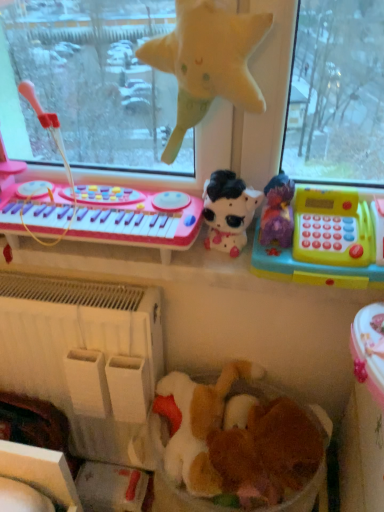
This screenshot has width=384, height=512. Describe the element at coordinates (107, 215) in the screenshot. I see `pink plastic musical keyboard at left` at that location.

What do you see at coordinates (228, 211) in the screenshot? The height and width of the screenshot is (512, 384). I see `plush black and white cow at center, arranged as the 2th toy when viewed from the top` at bounding box center [228, 211].

This screenshot has height=512, width=384. What do you see at coordinates (83, 354) in the screenshot?
I see `white plastic radiator at lower left` at bounding box center [83, 354].

Measure the distance between yellow plush star at upper center, which appears as the 5th toy when ordered from the bottom, and camera.

yellow plush star at upper center, which appears as the 5th toy when ordered from the bottom, is 26.33 inches away from camera.

In order to face yellow plastic cash register at right, the third toy in the top-to-bottom sequence, should I rotate leftwards or rightwards?

Turn right by 17.354 degrees to look at yellow plastic cash register at right, the third toy in the top-to-bottom sequence.

Identify the location of fuzzy brown teddy bear at center, positioned as the 1th toy in bottom-to-top order. This screenshot has width=384, height=512. (269, 452).

Based on the photo, who is bigger, plush black and white cow at center, positioned as the fourth toy in bottom-to-top order, or fuzzy brown teddy bear at center, which appears as the fifth toy when viewed from the top?

fuzzy brown teddy bear at center, which appears as the fifth toy when viewed from the top.

In terms of height, does plush black and white cow at center, arranged as the 2th toy when viewed from the top, look taller or shorter compared to fuzzy brown teddy bear at center, which appears as the fifth toy when viewed from the top?

Considering their sizes, plush black and white cow at center, arranged as the 2th toy when viewed from the top, has more height than fuzzy brown teddy bear at center, which appears as the fifth toy when viewed from the top.

Is plush black and white cow at center, positioned as the fourth toy in bottom-to-top order, turned away from fuzzy brown teddy bear at center, which appears as the fifth toy when viewed from the top?

plush black and white cow at center, positioned as the fourth toy in bottom-to-top order, is not turned away from fuzzy brown teddy bear at center, which appears as the fifth toy when viewed from the top.

Between plush black and white cow at center, positioned as the fourth toy in bottom-to-top order, and fuzzy brown teddy bear at center, which appears as the fifth toy when viewed from the top, which one appears on the right side from the viewer's perspective?

From the viewer's perspective, fuzzy brown teddy bear at center, which appears as the fifth toy when viewed from the top, appears more on the right side.

How much distance is there between white plastic radiator at lower left and fuzzy brown teddy bear at center, which appears as the fifth toy when viewed from the top?

A distance of 37.92 centimeters exists between white plastic radiator at lower left and fuzzy brown teddy bear at center, which appears as the fifth toy when viewed from the top.

Are white plastic radiator at lower left and fuzzy brown teddy bear at center, which appears as the fifth toy when viewed from the top, far apart?

No, white plastic radiator at lower left is in close proximity to fuzzy brown teddy bear at center, which appears as the fifth toy when viewed from the top.

Starting from the white plastic radiator at lower left, which toy is the 3rd one in front? Please provide its 2D coordinates.

[(269, 452)]

How many degrees apart are the facing directions of white plastic radiator at lower left and fuzzy brown teddy bear at center, positioned as the 1th toy in bottom-to-top order?

The facing directions of white plastic radiator at lower left and fuzzy brown teddy bear at center, positioned as the 1th toy in bottom-to-top order, are 179 degrees apart.

Which object is wider, plush black and white cow at center, arranged as the 2th toy when viewed from the top, or white plastic radiator at lower left?

With larger width is white plastic radiator at lower left.

Is plush black and white cow at center, arranged as the 2th toy when viewed from the top, to the right of white plastic radiator at lower left from the viewer's perspective?

Yes.

Is plush black and white cow at center, positioned as the fourth toy in bottom-to-top order, positioned far away from white plastic radiator at lower left?

No, plush black and white cow at center, positioned as the fourth toy in bottom-to-top order, is not far away from white plastic radiator at lower left.

Is yellow plastic cash register at right, the third toy in the top-to-bottom sequence, completely or partially inside pink plastic musical keyboard at left?

No, yellow plastic cash register at right, the third toy in the top-to-bottom sequence, is not a part of pink plastic musical keyboard at left.

Is pink plastic musical keyboard at left looking in the opposite direction of yellow plastic cash register at right, the third toy in the top-to-bottom sequence?

No, yellow plastic cash register at right, the third toy in the top-to-bottom sequence, is not at the back of pink plastic musical keyboard at left.

Which point is more distant from viewer, (108, 240) or (373, 247)?

The point (108, 240) is behind.

Which of these two, pink plastic musical keyboard at left or yellow plastic cash register at right, which is counted as the 3th toy, starting from the bottom, is wider?

pink plastic musical keyboard at left is wider.

Measure the distance between yellow plastic cash register at right, the third toy in the top-to-bottom sequence, and plush black and white cow at center, arranged as the 2th toy when viewed from the top.

yellow plastic cash register at right, the third toy in the top-to-bottom sequence, is 5.51 inches from plush black and white cow at center, arranged as the 2th toy when viewed from the top.

Can you tell me how much yellow plastic cash register at right, which is counted as the 3th toy, starting from the bottom, and plush black and white cow at center, arranged as the 2th toy when viewed from the top, differ in facing direction?

0.00216 degrees.

From the image's perspective, would you say yellow plastic cash register at right, which is counted as the 3th toy, starting from the bottom, is shown under plush black and white cow at center, arranged as the 2th toy when viewed from the top?

Yes, from the image's perspective, yellow plastic cash register at right, which is counted as the 3th toy, starting from the bottom, is beneath plush black and white cow at center, arranged as the 2th toy when viewed from the top.

Considering the relative sizes of yellow plastic cash register at right, which is counted as the 3th toy, starting from the bottom, and plush black and white cow at center, positioned as the fourth toy in bottom-to-top order, in the image provided, is yellow plastic cash register at right, which is counted as the 3th toy, starting from the bottom, shorter than plush black and white cow at center, positioned as the fourth toy in bottom-to-top order,?

Incorrect, the height of yellow plastic cash register at right, which is counted as the 3th toy, starting from the bottom, does not fall short of that of plush black and white cow at center, positioned as the fourth toy in bottom-to-top order.

Who is shorter, fuzzy brown teddy bear at center, which appears as the fifth toy when viewed from the top, or plush black and white cow at center, arranged as the 2th toy when viewed from the top?

With less height is fuzzy brown teddy bear at center, which appears as the fifth toy when viewed from the top.

From the image's perspective, is fuzzy brown teddy bear at center, positioned as the 1th toy in bottom-to-top order, located above plush black and white cow at center, arranged as the 2th toy when viewed from the top?

No, from the image's perspective, fuzzy brown teddy bear at center, positioned as the 1th toy in bottom-to-top order, is not above plush black and white cow at center, arranged as the 2th toy when viewed from the top.

Looking at their sizes, would you say fuzzy brown teddy bear at center, which appears as the fifth toy when viewed from the top, is wider or thinner than plush black and white cow at center, arranged as the 2th toy when viewed from the top?

fuzzy brown teddy bear at center, which appears as the fifth toy when viewed from the top, is wider than plush black and white cow at center, arranged as the 2th toy when viewed from the top.

How different are the orientations of fuzzy brown teddy bear at center, positioned as the 1th toy in bottom-to-top order, and plush black and white cow at center, arranged as the 2th toy when viewed from the top, in degrees?

The angle between the facing direction of fuzzy brown teddy bear at center, positioned as the 1th toy in bottom-to-top order, and the facing direction of plush black and white cow at center, arranged as the 2th toy when viewed from the top, is 179 degrees.

Between pink plastic musical keyboard at left and plush black and white cow at center, positioned as the fourth toy in bottom-to-top order, which one has larger size?

Bigger between the two is pink plastic musical keyboard at left.

Is pink plastic musical keyboard at left further to the viewer compared to plush black and white cow at center, arranged as the 2th toy when viewed from the top?

No, it is not.

Could you measure the distance between pink plastic musical keyboard at left and plush black and white cow at center, positioned as the fourth toy in bottom-to-top order?

A distance of 7.25 inches exists between pink plastic musical keyboard at left and plush black and white cow at center, positioned as the fourth toy in bottom-to-top order.

Is pink plastic musical keyboard at left inside the boundaries of plush black and white cow at center, arranged as the 2th toy when viewed from the top, or outside?

pink plastic musical keyboard at left cannot be found inside plush black and white cow at center, arranged as the 2th toy when viewed from the top.

At what (x,y) coordinates should I click in order to perform the action: click on the 3rd toy below the plush black and white cow at center, arranged as the 2th toy when viewed from the top (from the image's perspective). Please return your answer as a coordinate pair (x, y). Looking at the image, I should click on (269, 452).

Which toy is the 4th one when counting from the right side of the white plastic radiator at lower left? Please provide its 2D coordinates.

[(269, 452)]

Based on their spatial positions, is yellow plush star at upper center, which appears as the 5th toy when ordered from the bottom, or fuzzy brown teddy bear at center, which appears as the fifth toy when viewed from the top, closer to white plastic radiator at lower left?

Based on the image, fuzzy brown teddy bear at center, which appears as the fifth toy when viewed from the top, appears to be nearer to white plastic radiator at lower left.

When comparing their distances from fuzzy brown teddy bear at center, which appears as the fifth toy when viewed from the top, does pink plastic musical keyboard at left or yellow plush star at upper center, positioned as the 1th toy in top-to-bottom order, seem further?

Among the two, yellow plush star at upper center, positioned as the 1th toy in top-to-bottom order, is located further to fuzzy brown teddy bear at center, which appears as the fifth toy when viewed from the top.

When comparing their distances from yellow plastic cash register at right, which is counted as the 3th toy, starting from the bottom, does pink plastic musical keyboard at left or yellow plush star at upper center, positioned as the 1th toy in top-to-bottom order, seem closer?

The object closer to yellow plastic cash register at right, which is counted as the 3th toy, starting from the bottom, is yellow plush star at upper center, positioned as the 1th toy in top-to-bottom order.

When comparing their distances from white plastic radiator at lower left, does fluffy white stuffed animal at center, which is the fourth toy from top to bottom, or pink plastic musical keyboard at left seem closer?

fluffy white stuffed animal at center, which is the fourth toy from top to bottom, lies closer to white plastic radiator at lower left than the other object.

In the scene shown: Estimate the real-world distances between objects in this image. Which object is closer to pink plastic musical keyboard at left, fuzzy brown teddy bear at center, which appears as the fifth toy when viewed from the top, or yellow plastic cash register at right, which is counted as the 3th toy, starting from the bottom?

Based on the image, yellow plastic cash register at right, which is counted as the 3th toy, starting from the bottom, appears to be nearer to pink plastic musical keyboard at left.

When comparing their distances from fluffy white stuffed animal at center, which is the fourth toy from top to bottom, does fuzzy brown teddy bear at center, which appears as the fifth toy when viewed from the top, or yellow plush star at upper center, positioned as the 1th toy in top-to-bottom order, seem closer?

fuzzy brown teddy bear at center, which appears as the fifth toy when viewed from the top, lies closer to fluffy white stuffed animal at center, which is the fourth toy from top to bottom, than the other object.

Which object lies nearer to the anchor point yellow plush star at upper center, positioned as the 1th toy in top-to-bottom order, plush black and white cow at center, positioned as the fourth toy in bottom-to-top order, or yellow plastic cash register at right, the third toy in the top-to-bottom sequence?

plush black and white cow at center, positioned as the fourth toy in bottom-to-top order.

From the image, which object appears to be nearer to plush black and white cow at center, arranged as the 2th toy when viewed from the top, yellow plush star at upper center, which appears as the 5th toy when ordered from the bottom, or white plastic radiator at lower left?

yellow plush star at upper center, which appears as the 5th toy when ordered from the bottom.

This screenshot has width=384, height=512. What are the coordinates of `musical keyboard between yellow plush star at upper center, which appears as the 5th toy when ordered from the bottom, and fluffy white stuffed animal at center, which is the fourth toy from top to bottom, in the up-down direction` in the screenshot? It's located at (107, 215).

Where is `musical keyboard between white plastic radiator at lower left and yellow plastic cash register at right, the third toy in the top-to-bottom sequence, from left to right`? The image size is (384, 512). musical keyboard between white plastic radiator at lower left and yellow plastic cash register at right, the third toy in the top-to-bottom sequence, from left to right is located at coordinates pos(107,215).

Where is `radiator between yellow plush star at upper center, positioned as the 1th toy in top-to-bottom order, and fluffy white stuffed animal at center, which is the fourth toy from top to bottom, in the vertical direction`? radiator between yellow plush star at upper center, positioned as the 1th toy in top-to-bottom order, and fluffy white stuffed animal at center, which is the fourth toy from top to bottom, in the vertical direction is located at coordinates (83, 354).

Where is `toy between yellow plastic cash register at right, which is counted as the 3th toy, starting from the bottom, and fuzzy brown teddy bear at center, which appears as the fifth toy when viewed from the top, in the vertical direction`? This screenshot has height=512, width=384. toy between yellow plastic cash register at right, which is counted as the 3th toy, starting from the bottom, and fuzzy brown teddy bear at center, which appears as the fifth toy when viewed from the top, in the vertical direction is located at coordinates (201, 424).